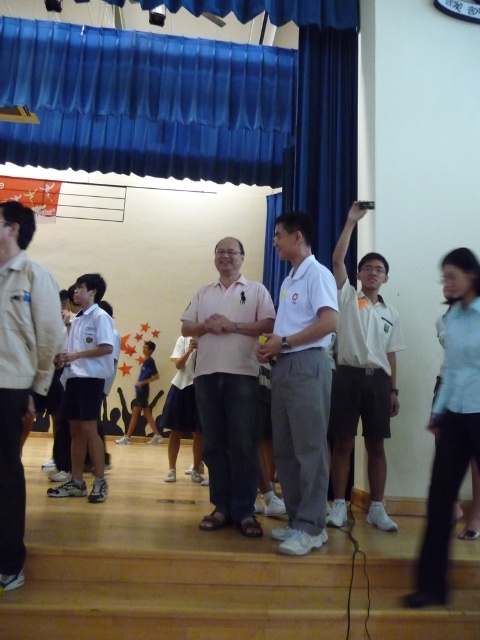
Question: Is beige fabric shirt at center thinner than white matte uniform at center?

Choices:
 (A) no
 (B) yes

Answer: (B)

Question: Which point is closer to the camera?

Choices:
 (A) (255, 184)
 (B) (323, 500)

Answer: (B)

Question: Where is blue fabric curtain at upper center located in relation to pink fabric shirt at center in the image?

Choices:
 (A) left
 (B) right

Answer: (A)

Question: Which point is closer to the camera?

Choices:
 (A) (3, 368)
 (B) (447, 340)
 (C) (357, 376)

Answer: (A)

Question: Can you confirm if blue fabric curtain at upper center is bigger than pink fabric shirt at center?

Choices:
 (A) yes
 (B) no

Answer: (A)

Question: Which object is the closest to the pink fabric shirt at center?

Choices:
 (A) white matte uniform at center
 (B) light blue shirt at right

Answer: (A)